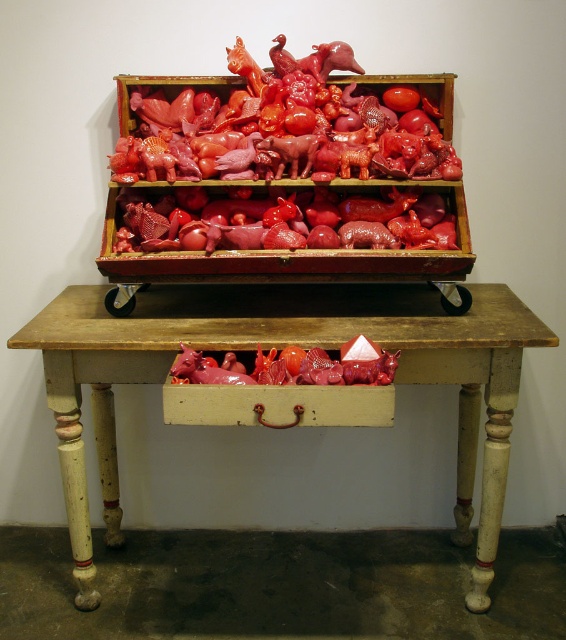
Is point (310, 186) positioned behind point (350, 368)?

Yes, point (310, 186) is farther from viewer.

Is glossy plastic box at center to the right of glossy plastic tomato at center from the viewer's perspective?

In fact, glossy plastic box at center is to the left of glossy plastic tomato at center.

At what (x,y) coordinates should I click in order to perform the action: click on glossy plastic box at center. Please return your answer as a coordinate pair (x, y). This screenshot has width=566, height=640. Looking at the image, I should click on (284, 184).

The height and width of the screenshot is (640, 566). Find the location of `glossy plastic box at center`. glossy plastic box at center is located at coordinates (284, 184).

Looking at this image, measure the distance between point (140,273) and camera.

A distance of 5.86 feet exists between point (140,273) and camera.

The image size is (566, 640). In order to click on glossy plastic box at center in this screenshot , I will do `click(284, 184)`.

Is point (208, 321) more distant than point (323, 364)?

Yes.

Does point (174, 296) lie in front of point (207, 380)?

No, it is behind (207, 380).

Image resolution: width=566 pixels, height=640 pixels. Describe the element at coordinates (280, 346) in the screenshot. I see `wooden table at center` at that location.

Locate an element on the screen. wooden table at center is located at coordinates (280, 346).